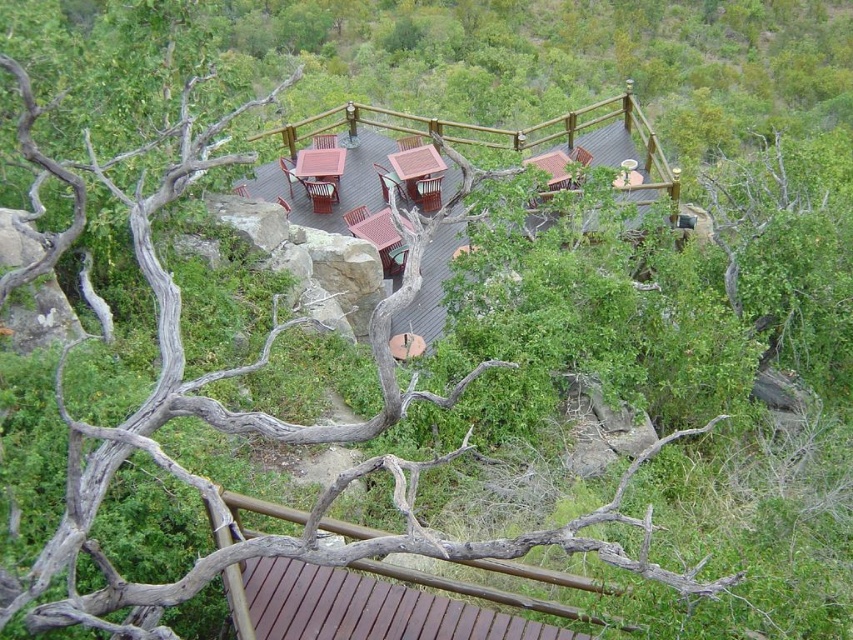
Locate an element on the screen. The image size is (853, 640). brown wooden table at center is located at coordinates (419, 173).

Consider the image. Which is more to the left, brown wooden table at center or wooden hut at center?

wooden hut at center

You are a GUI agent. You are given a task and a screenshot of the screen. Output one action in this format:
    pyautogui.click(x=<x>, y=<y>)
    Task: Click on the brown wooden table at center
    
    Given the screenshot: What is the action you would take?
    pyautogui.click(x=419, y=173)

From the picture: Does wooden hut at center appear on the left side of brown wooden hut at upper right?

Yes, wooden hut at center is to the left of brown wooden hut at upper right.

Which is behind, point (380, 216) or point (560, 164)?

Positioned behind is point (560, 164).

Is point (387, 227) farther from viewer compared to point (554, 156)?

No, (387, 227) is in front of (554, 156).

You are a GUI agent. You are given a task and a screenshot of the screen. Output one action in this format:
    pyautogui.click(x=<x>, y=<y>)
    Task: Click on the wooden hut at center
    Image resolution: width=853 pixels, height=640 pixels.
    Given the screenshot: What is the action you would take?
    pyautogui.click(x=379, y=236)

Who is more forward, (328,220) or (549,179)?

Point (549,179) is in front.

What do you see at coordinates (465, 147) in the screenshot?
I see `wooden deck at center` at bounding box center [465, 147].

The width and height of the screenshot is (853, 640). I want to click on wooden deck at center, so click(465, 147).